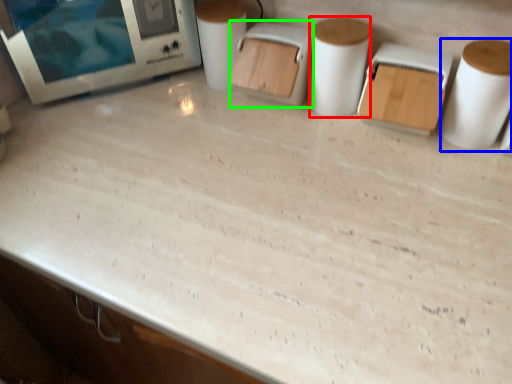
Question: Which object is positioned closest to paper towel (highlighted by a red box)? Select from paper towel (highlighted by a blue box) and appliance (highlighted by a green box).

Choices:
 (A) paper towel
 (B) appliance

Answer: (B)